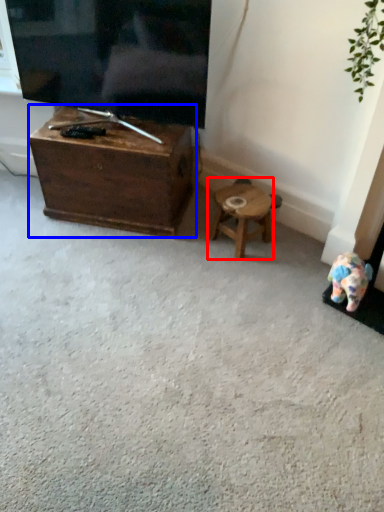
Question: Which point is closer to the camera, stool (highlighted by a red box) or table (highlighted by a blue box)?

Choices:
 (A) stool
 (B) table

Answer: (B)